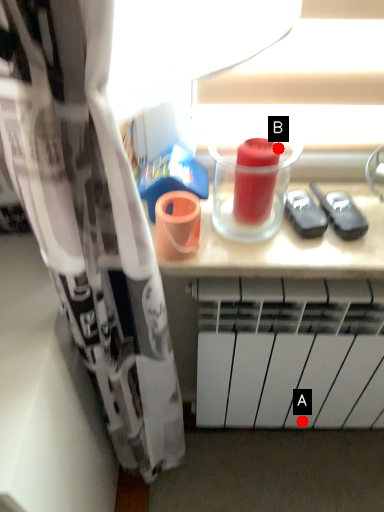
Question: Two points are circled on the image, labeled by A and B beside each circle. Which of the following is the farthest from the observer?

Choices:
 (A) A is further
 (B) B is further

Answer: (A)